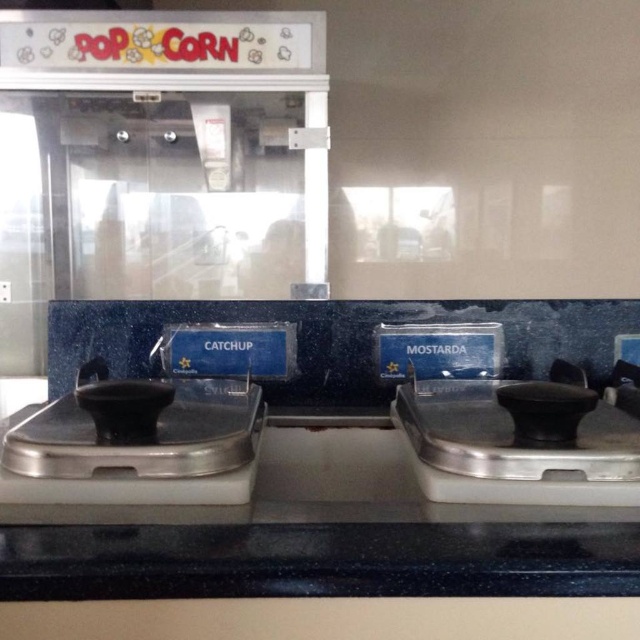
Can you confirm if black plastic tray at center is shorter than black rubber condiment dispenser at right?

Yes, black plastic tray at center is shorter than black rubber condiment dispenser at right.

The image size is (640, 640). Describe the element at coordinates (317, 560) in the screenshot. I see `black plastic tray at center` at that location.

Where is `black plastic tray at center`? The height and width of the screenshot is (640, 640). black plastic tray at center is located at coordinates (317, 560).

Measure the distance from black plastic tray at center to satin silver dispenser at left.

The distance of black plastic tray at center from satin silver dispenser at left is 4.11 inches.

Does black plastic tray at center appear over satin silver dispenser at left?

No, black plastic tray at center is not above satin silver dispenser at left.

The height and width of the screenshot is (640, 640). What do you see at coordinates (317, 560) in the screenshot? I see `black plastic tray at center` at bounding box center [317, 560].

The image size is (640, 640). In order to click on black plastic tray at center in this screenshot , I will do `click(317, 560)`.

Does point (49, 420) lie behind point (582, 460)?

Yes.

Does satin silver dispenser at left appear on the right side of black rubber condiment dispenser at right?

In fact, satin silver dispenser at left is to the left of black rubber condiment dispenser at right.

Image resolution: width=640 pixels, height=640 pixels. What do you see at coordinates (140, 451) in the screenshot? I see `satin silver dispenser at left` at bounding box center [140, 451].

Image resolution: width=640 pixels, height=640 pixels. I want to click on satin silver dispenser at left, so click(140, 451).